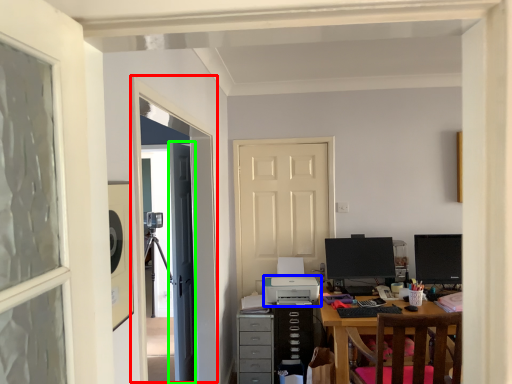
Question: Which object is the closest to the screen door (highlighted by a red box)? Choose among these: printer (highlighted by a blue box) or door (highlighted by a green box).

Choices:
 (A) printer
 (B) door

Answer: (B)